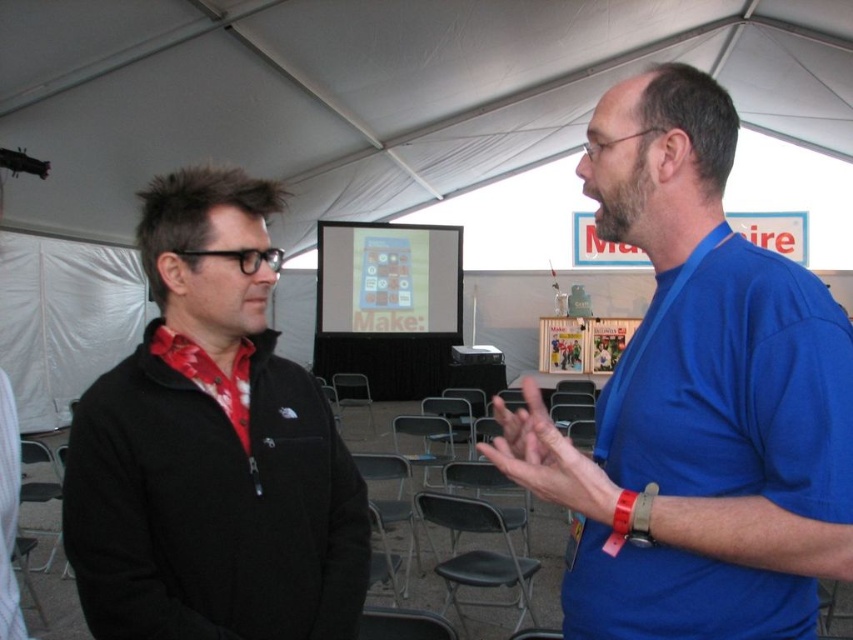
Question: Is blue fabric shirt at right wider than black fleece jacket at left?

Choices:
 (A) yes
 (B) no

Answer: (A)

Question: Which point is closer to the camera taking this photo?

Choices:
 (A) coord(283,368)
 (B) coord(659,115)

Answer: (B)

Question: Does blue fabric shirt at right lie in front of black fleece jacket at left?

Choices:
 (A) no
 (B) yes

Answer: (B)

Question: Can you confirm if blue fabric shirt at right is smaller than black fleece jacket at left?

Choices:
 (A) no
 (B) yes

Answer: (A)